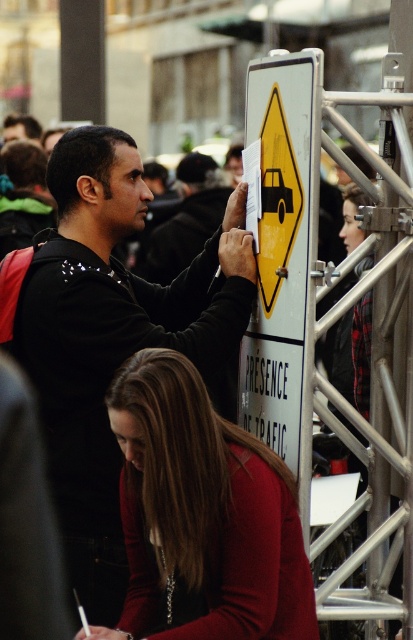
Can you confirm if black matte shirt at upper left is positioned above matte red sweater at lower center?

Indeed, black matte shirt at upper left is positioned over matte red sweater at lower center.

Is point (83, 282) less distant than point (175, 534)?

No, it is not.

Between point (64, 289) and point (222, 593), which one is positioned in front?

Point (222, 593) is more forward.

Where is `black matte shirt at upper left`? black matte shirt at upper left is located at coordinates click(111, 336).

Can you confirm if matte red sweater at lower center is positioned below black matte shirt at center?

Indeed, matte red sweater at lower center is positioned under black matte shirt at center.

Describe the element at coordinates (203, 515) in the screenshot. The width and height of the screenshot is (413, 640). I see `matte red sweater at lower center` at that location.

Locate an element on the screen. This screenshot has width=413, height=640. matte red sweater at lower center is located at coordinates (203, 515).

Locate an element on the screen. The image size is (413, 640). matte red sweater at lower center is located at coordinates (203, 515).

Is black matte shirt at upper left further to the viewer compared to black matte shirt at center?

No, black matte shirt at upper left is in front of black matte shirt at center.

Which is more to the right, black matte shirt at upper left or black matte shirt at center?

black matte shirt at center

The image size is (413, 640). Find the location of `black matte shirt at upper left`. black matte shirt at upper left is located at coordinates (111, 336).